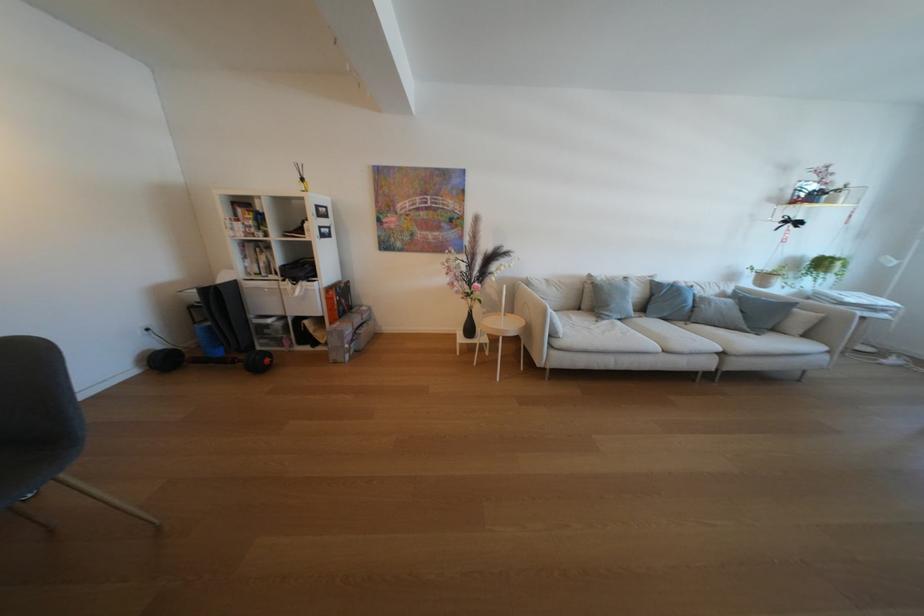
Find where to lean the white sofa armrest. Please return your answer as a coordinate pair (x, y).

(532, 322)